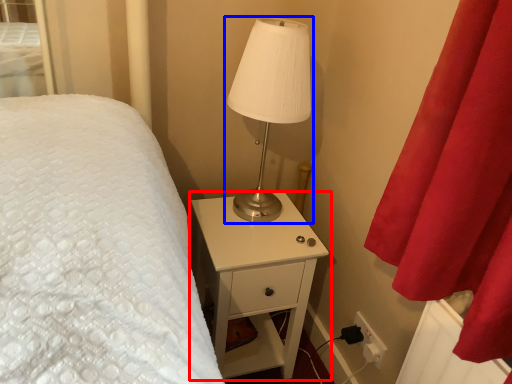
Question: Which object appears closest to the camera in this image, nightstand (highlighted by a red box) or lamp (highlighted by a blue box)?

Choices:
 (A) nightstand
 (B) lamp

Answer: (B)